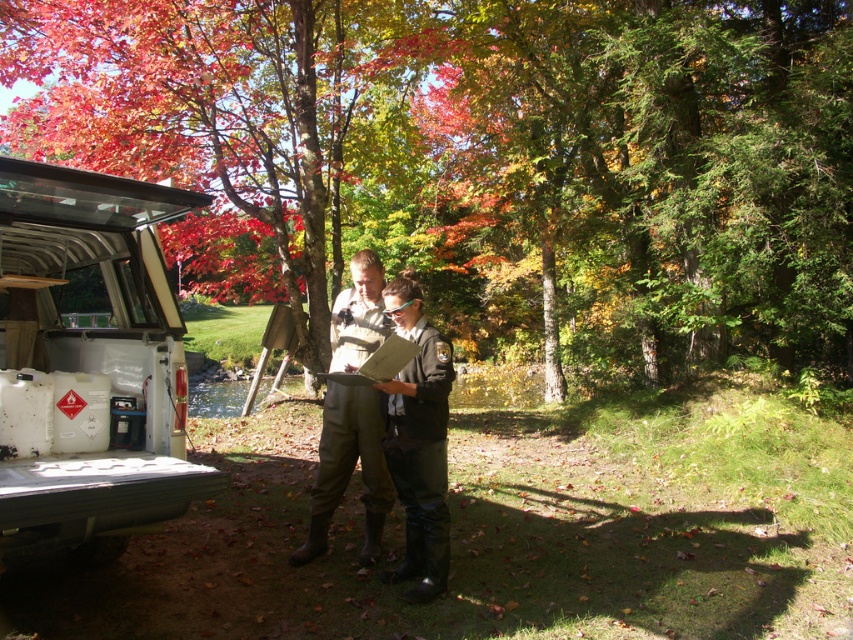
You are a park ranger in the autumn forest. You notice a green leafy tree at center and a wooden clipboard at center. Which object is positioned to the left?

The green leafy tree at center is to the left of the wooden clipboard at center.

You are a park ranger who needs to retrieve the white plastic container at lower left for a safety inspection. If your reach extends 2 feet in front of you, can you grab it without moving your feet?

The white plastic container at lower left is 10.14 feet away from the camera. Since your reach only extends 2 feet, you cannot grab it without moving closer.